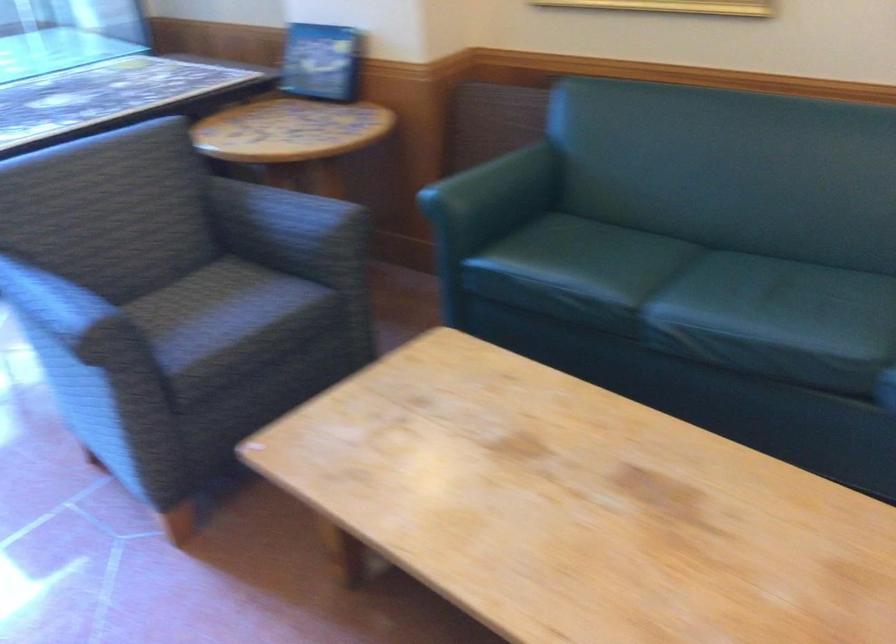
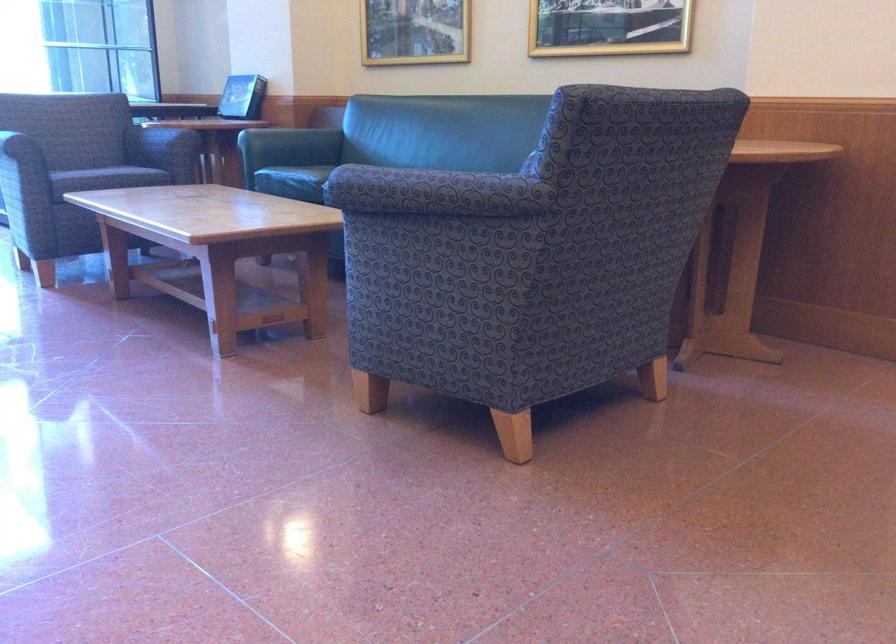
Where in the second image is the point corresponding to (272,346) from the first image?

(115, 176)